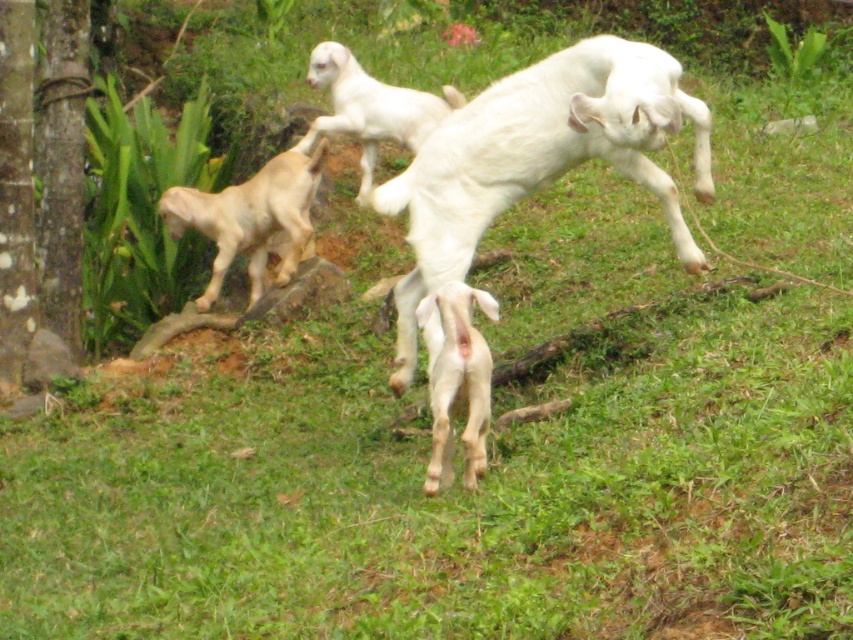
Question: Which is nearer to the light beige fur at left?

Choices:
 (A) white woolen goat at upper center
 (B) white woolen goat at center

Answer: (A)

Question: Does white matte goat at center appear on the right side of white woolen goat at upper center?

Choices:
 (A) yes
 (B) no

Answer: (A)

Question: Can you confirm if white woolen goat at center is positioned to the left of light beige fur at left?

Choices:
 (A) yes
 (B) no

Answer: (B)

Question: Based on their relative distances, which object is farther from the light beige fur at left?

Choices:
 (A) white woolen goat at center
 (B) white matte goat at center

Answer: (B)

Question: Considering the relative positions of white woolen goat at center and white woolen goat at upper center in the image provided, where is white woolen goat at center located with respect to white woolen goat at upper center?

Choices:
 (A) above
 (B) below

Answer: (B)

Question: Which object appears farthest from the camera in this image?

Choices:
 (A) white woolen goat at upper center
 (B) light beige fur at left
 (C) white matte goat at center
 (D) white woolen goat at center

Answer: (B)